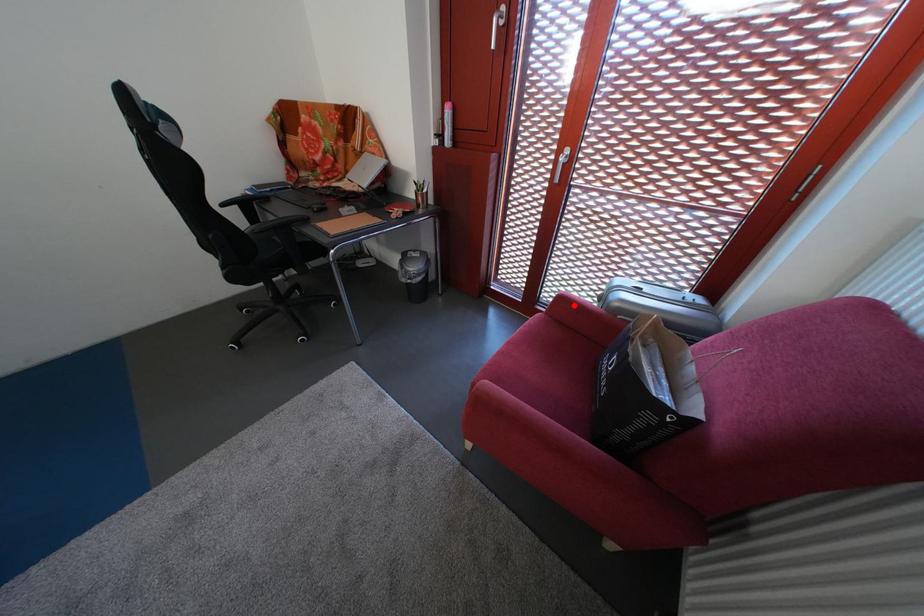
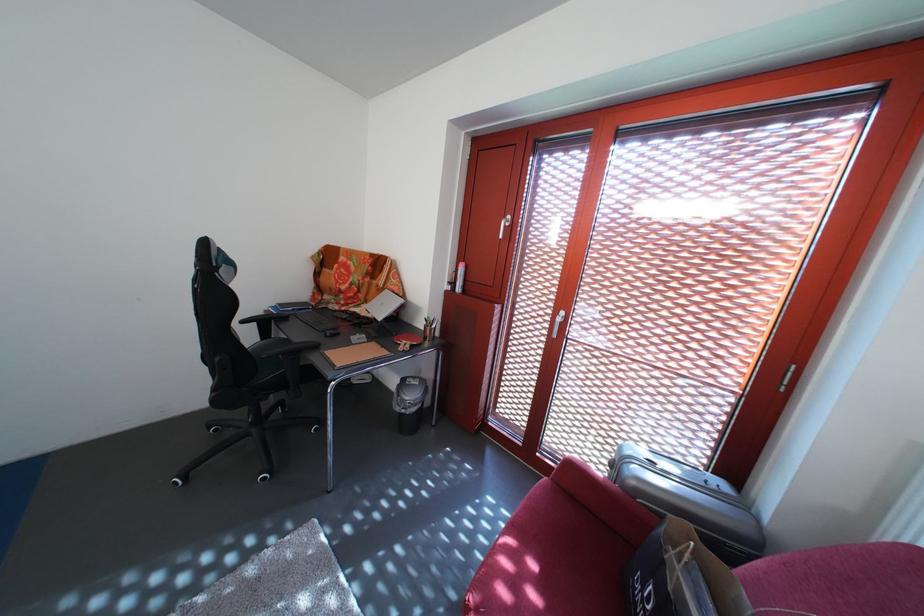
Locate, in the second image, the point that corresponds to the highlighted location in the first image.

(584, 475)